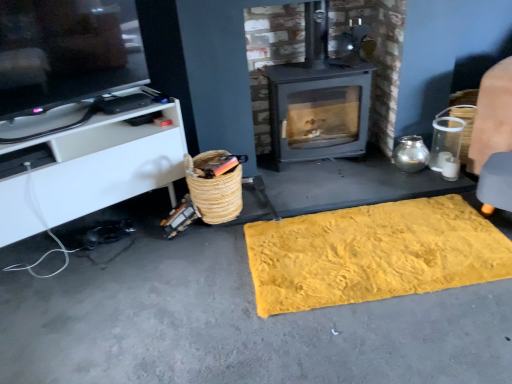
Question: From their relative heights in the image, would you say woven straw basket at lower left is taller or shorter than matte black tv at upper left?

Choices:
 (A) tall
 (B) short

Answer: (B)

Question: From the image's perspective, is woven straw basket at lower left positioned above or below matte black tv at upper left?

Choices:
 (A) above
 (B) below

Answer: (B)

Question: Which object is positioned closest to the yellow textured rug at lower center?

Choices:
 (A) woven straw basket at lower left
 (B) yellow textured mat at center
 (C) white matte cabinet at left
 (D) matte black tv at upper left
 (E) matte gray wood burning stove at center

Answer: (B)

Question: Estimate the real-world distances between objects in this image. Which object is closer to the matte gray wood burning stove at center?

Choices:
 (A) matte black tv at upper left
 (B) woven straw basket at lower left
 (C) yellow textured rug at lower center
 (D) white matte cabinet at left
 (E) yellow textured mat at center

Answer: (B)